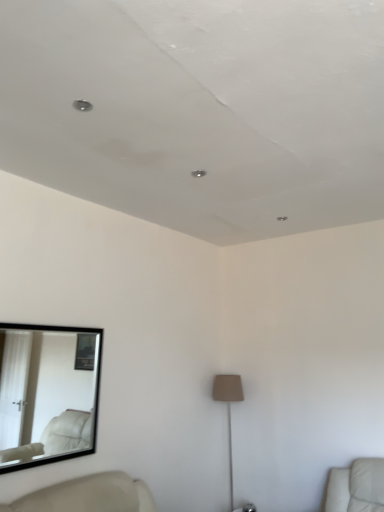
Question: Is black framed mirror at left inside the boundaries of beige fabric lamp at center, or outside?

Choices:
 (A) outside
 (B) inside

Answer: (A)

Question: Considering the positions of black framed mirror at left and beige fabric lamp at center in the image, is black framed mirror at left wider or thinner than beige fabric lamp at center?

Choices:
 (A) wide
 (B) thin

Answer: (B)

Question: In the image, is black framed mirror at left positioned in front of or behind beige fabric lamp at center?

Choices:
 (A) front
 (B) behind

Answer: (A)

Question: From the image's perspective, is beige fabric lamp at center located above or below black framed mirror at left?

Choices:
 (A) below
 (B) above

Answer: (A)

Question: From their relative heights in the image, would you say beige fabric lamp at center is taller or shorter than black framed mirror at left?

Choices:
 (A) short
 (B) tall

Answer: (B)

Question: Looking at their shapes, would you say beige fabric lamp at center is wider or thinner than black framed mirror at left?

Choices:
 (A) wide
 (B) thin

Answer: (A)

Question: Is beige fabric lamp at center to the left or to the right of black framed mirror at left in the image?

Choices:
 (A) right
 (B) left

Answer: (A)